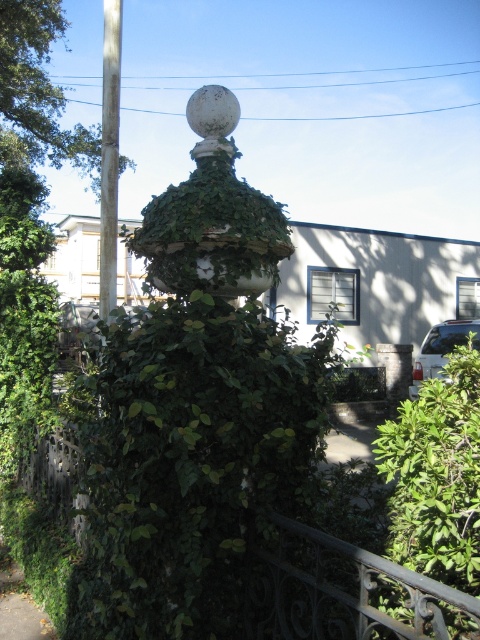
Question: Is green leafy bush at lower right above brown wooden pole at left?

Choices:
 (A) yes
 (B) no

Answer: (B)

Question: Can you confirm if green leafy bush at lower right is wider than brown wood tree at upper left?

Choices:
 (A) no
 (B) yes

Answer: (A)

Question: Which point is closer to the camera?

Choices:
 (A) (421, 456)
 (B) (107, 81)

Answer: (A)

Question: Which point is closer to the camera?

Choices:
 (A) brown wood tree at upper left
 (B) green leafy bush at lower right
 (C) green ivy-covered fence at center
 (D) brown wooden pole at left

Answer: (C)

Question: Is green leafy bush at lower right further to camera compared to brown wood tree at upper left?

Choices:
 (A) yes
 (B) no

Answer: (B)

Question: Which object is the farthest from the brown wooden pole at left?

Choices:
 (A) green leafy bush at lower right
 (B) green ivy-covered fence at center

Answer: (B)